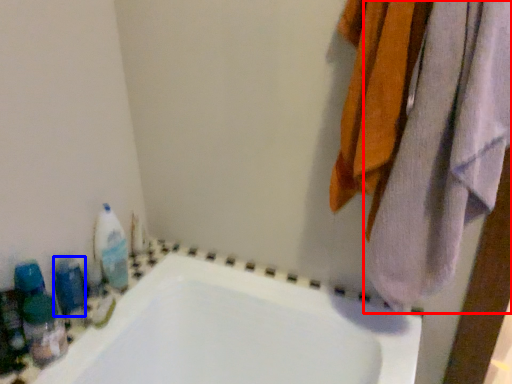
Question: Among these objects, which one is farthest to the camera, towel (highlighted by a red box) or toiletry (highlighted by a blue box)?

Choices:
 (A) towel
 (B) toiletry

Answer: (B)